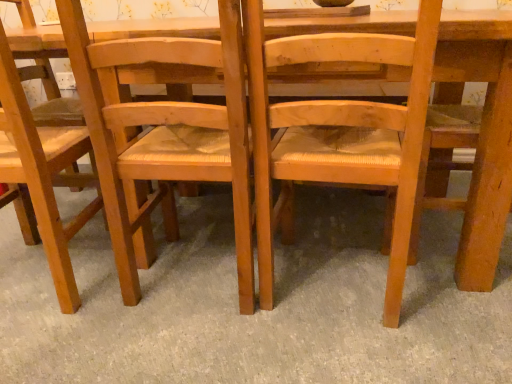
What do you see at coordinates (57, 106) in the screenshot? I see `light brown wood chair at left, which ranks as the 1th chair in left-to-right order` at bounding box center [57, 106].

Image resolution: width=512 pixels, height=384 pixels. What are the coordinates of `light brown wood chair at left, which ranks as the 1th chair in left-to-right order` in the screenshot? It's located at [57, 106].

Locate an element on the screen. This screenshot has width=512, height=384. natural wood chair at center, which ranks as the first chair in right-to-left order is located at coordinates (340, 133).

Identify the location of light brown wood chair at left, arranged as the 3th chair when viewed from the right. This screenshot has height=384, width=512. (57, 106).

From the image's perspective, which object appears higher, light brown wood chair at left, which ranks as the 1th chair in left-to-right order, or wooden woven seat at center, the 2th chair when ordered from right to left?

wooden woven seat at center, the 2th chair when ordered from right to left, appears higher in the image.

Is light brown wood chair at left, which ranks as the 1th chair in left-to-right order, far from wooden woven seat at center, the 2th chair when ordered from right to left?

light brown wood chair at left, which ranks as the 1th chair in left-to-right order, is near wooden woven seat at center, the 2th chair when ordered from right to left, not far away.

In terms of height, does light brown wood chair at left, which ranks as the 1th chair in left-to-right order, look taller or shorter compared to wooden woven seat at center, the second chair in the left-to-right sequence?

Considering their sizes, light brown wood chair at left, which ranks as the 1th chair in left-to-right order, has more height than wooden woven seat at center, the second chair in the left-to-right sequence.

The image size is (512, 384). Identify the location of chair that appears above the wooden woven seat at center, the second chair in the left-to-right sequence (from a real-world perspective). (57, 106).

Between wooden woven seat at center, the 2th chair when ordered from right to left, and natural wood chair at center, which ranks as the first chair in right-to-left order, which one appears on the left side from the viewer's perspective?

Positioned to the left is wooden woven seat at center, the 2th chair when ordered from right to left.

Considering the relative positions of wooden woven seat at center, the second chair in the left-to-right sequence, and natural wood chair at center, which ranks as the first chair in right-to-left order, in the image provided, is wooden woven seat at center, the second chair in the left-to-right sequence, behind natural wood chair at center, which ranks as the first chair in right-to-left order,?

Yes, wooden woven seat at center, the second chair in the left-to-right sequence, is behind natural wood chair at center, which ranks as the first chair in right-to-left order.

From the image's perspective, is natural wood chair at center, which ranks as the first chair in right-to-left order, located above or below light brown wood chair at left, which ranks as the 1th chair in left-to-right order?

Clearly, from the image's perspective, natural wood chair at center, which ranks as the first chair in right-to-left order, is below light brown wood chair at left, which ranks as the 1th chair in left-to-right order.

Which object is further away from the camera, natural wood chair at center, the third chair viewed from the left, or light brown wood chair at left, arranged as the 3th chair when viewed from the right?

light brown wood chair at left, arranged as the 3th chair when viewed from the right, is further away from the camera.

Is natural wood chair at center, which ranks as the first chair in right-to-left order, next to light brown wood chair at left, arranged as the 3th chair when viewed from the right, and touching it?

They are not placed beside each other.

Which of these two, wooden woven seat at center, the 2th chair when ordered from right to left, or light brown wood chair at left, which ranks as the 1th chair in left-to-right order, stands shorter?

wooden woven seat at center, the 2th chair when ordered from right to left, is shorter.

Locate an element on the screen. the 1st chair counting from the right side of the light brown wood chair at left, which ranks as the 1th chair in left-to-right order is located at coordinates (165, 132).

Between point (114, 138) and point (148, 230), which one is positioned in front?

Point (114, 138)

Measure the distance from wooden woven seat at center, the second chair in the left-to-right sequence, to light brown wood chair at left, which ranks as the 1th chair in left-to-right order.

wooden woven seat at center, the second chair in the left-to-right sequence, and light brown wood chair at left, which ranks as the 1th chair in left-to-right order, are 19.21 inches apart from each other.

Choose the correct answer: Is light brown wood chair at left, arranged as the 3th chair when viewed from the right, inside natural wood chair at center, which ranks as the first chair in right-to-left order, or outside it?

light brown wood chair at left, arranged as the 3th chair when viewed from the right, is located beyond the bounds of natural wood chair at center, which ranks as the first chair in right-to-left order.

Which is in front, light brown wood chair at left, which ranks as the 1th chair in left-to-right order, or natural wood chair at center, the third chair viewed from the left?

natural wood chair at center, the third chair viewed from the left, is closer to the camera.

From the image's perspective, which is below, light brown wood chair at left, which ranks as the 1th chair in left-to-right order, or natural wood chair at center, the third chair viewed from the left?

natural wood chair at center, the third chair viewed from the left, from the image's perspective.

Which is more to the right, light brown wood chair at left, which ranks as the 1th chair in left-to-right order, or natural wood chair at center, which ranks as the first chair in right-to-left order?

natural wood chair at center, which ranks as the first chair in right-to-left order.

From a real-world perspective, is natural wood chair at center, the third chair viewed from the left, positioned above or below wooden woven seat at center, the 2th chair when ordered from right to left?

natural wood chair at center, the third chair viewed from the left, is situated lower than wooden woven seat at center, the 2th chair when ordered from right to left, in the real world.

Is wooden woven seat at center, the second chair in the left-to-right sequence, at the back of natural wood chair at center, the third chair viewed from the left?

No.

Are natural wood chair at center, which ranks as the first chair in right-to-left order, and wooden woven seat at center, the 2th chair when ordered from right to left, far apart?

natural wood chair at center, which ranks as the first chair in right-to-left order, is near wooden woven seat at center, the 2th chair when ordered from right to left, not far away.

Considering the relative sizes of natural wood chair at center, the third chair viewed from the left, and wooden woven seat at center, the second chair in the left-to-right sequence, in the image provided, is natural wood chair at center, the third chair viewed from the left, smaller than wooden woven seat at center, the second chair in the left-to-right sequence,?

Indeed, natural wood chair at center, the third chair viewed from the left, has a smaller size compared to wooden woven seat at center, the second chair in the left-to-right sequence.

This screenshot has height=384, width=512. I want to click on the 1st chair to the right of the light brown wood chair at left, arranged as the 3th chair when viewed from the right, counting from the anchor's position, so click(165, 132).

Image resolution: width=512 pixels, height=384 pixels. Identify the location of chair in front of the wooden woven seat at center, the 2th chair when ordered from right to left. click(340, 133).

Based on their spatial positions, is natural wood chair at center, which ranks as the first chair in right-to-left order, or light brown wood chair at left, which ranks as the 1th chair in left-to-right order, closer to wooden woven seat at center, the second chair in the left-to-right sequence?

The object closer to wooden woven seat at center, the second chair in the left-to-right sequence, is natural wood chair at center, which ranks as the first chair in right-to-left order.

Considering their positions, is light brown wood chair at left, which ranks as the 1th chair in left-to-right order, positioned closer to natural wood chair at center, the third chair viewed from the left, than wooden woven seat at center, the 2th chair when ordered from right to left?

The object closer to natural wood chair at center, the third chair viewed from the left, is wooden woven seat at center, the 2th chair when ordered from right to left.

Estimate the real-world distances between objects in this image. Which object is closer to light brown wood chair at left, arranged as the 3th chair when viewed from the right, natural wood chair at center, which ranks as the first chair in right-to-left order, or wooden woven seat at center, the second chair in the left-to-right sequence?

Based on the image, wooden woven seat at center, the second chair in the left-to-right sequence, appears to be nearer to light brown wood chair at left, arranged as the 3th chair when viewed from the right.

From the image, which object appears to be nearer to wooden woven seat at center, the second chair in the left-to-right sequence, light brown wood chair at left, arranged as the 3th chair when viewed from the right, or natural wood chair at center, which ranks as the first chair in right-to-left order?

natural wood chair at center, which ranks as the first chair in right-to-left order, is closer to wooden woven seat at center, the second chair in the left-to-right sequence.

Based on their spatial positions, is wooden woven seat at center, the 2th chair when ordered from right to left, or natural wood chair at center, which ranks as the first chair in right-to-left order, closer to light brown wood chair at left, which ranks as the 1th chair in left-to-right order?

Among the two, wooden woven seat at center, the 2th chair when ordered from right to left, is located nearer to light brown wood chair at left, which ranks as the 1th chair in left-to-right order.

Based on their spatial positions, is wooden woven seat at center, the 2th chair when ordered from right to left, or light brown wood chair at left, which ranks as the 1th chair in left-to-right order, further from natural wood chair at center, which ranks as the first chair in right-to-left order?

Based on the image, light brown wood chair at left, which ranks as the 1th chair in left-to-right order, appears to be further to natural wood chair at center, which ranks as the first chair in right-to-left order.

Where is `chair between light brown wood chair at left, which ranks as the 1th chair in left-to-right order, and natural wood chair at center, the third chair viewed from the left, in the horizontal direction`? chair between light brown wood chair at left, which ranks as the 1th chair in left-to-right order, and natural wood chair at center, the third chair viewed from the left, in the horizontal direction is located at coordinates (165, 132).